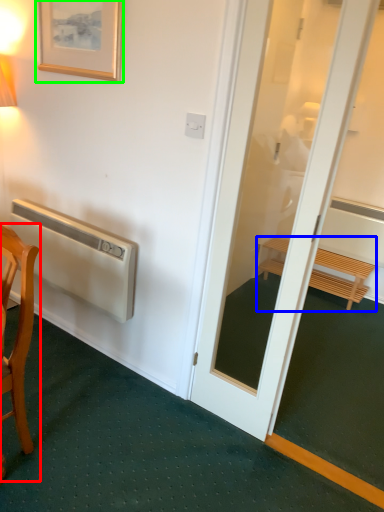
Question: Which object is positioned farthest from chair (highlighted by a red box)? Select from furniture (highlighted by a blue box) and picture frame (highlighted by a green box).

Choices:
 (A) furniture
 (B) picture frame

Answer: (A)